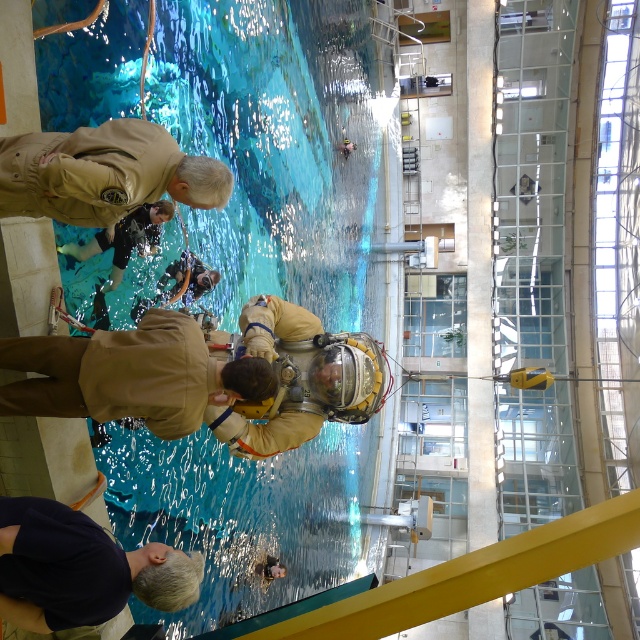
Can you confirm if blue clear water at center is taller than blue-green diving suit at center?

Correct, blue clear water at center is much taller as blue-green diving suit at center.

Measure the distance between point (372, 451) and camera.

Point (372, 451) is 56.99 meters away from camera.

This screenshot has height=640, width=640. What do you see at coordinates (280, 147) in the screenshot?
I see `blue clear water at center` at bounding box center [280, 147].

Where is `blue clear water at center`? This screenshot has height=640, width=640. blue clear water at center is located at coordinates (280, 147).

Can you confirm if blue-green diving suit at center is wider than light brown leather jacket at lower center?

Correct, the width of blue-green diving suit at center exceeds that of light brown leather jacket at lower center.

Between point (144, 220) and point (266, 556), which one is positioned in front?

Point (144, 220)

Find the location of a particular element. The width and height of the screenshot is (640, 640). blue-green diving suit at center is located at coordinates (124, 237).

Image resolution: width=640 pixels, height=640 pixels. Find the location of `blue-green diving suit at center`. blue-green diving suit at center is located at coordinates (124, 237).

Who is positioned more to the right, dark blue shirt at lower left or blue-green diving suit at center?

Positioned to the right is dark blue shirt at lower left.

Does dark blue shirt at lower left appear on the right side of blue-green diving suit at center?

Indeed, dark blue shirt at lower left is positioned on the right side of blue-green diving suit at center.

Find the location of a particular element. This screenshot has width=640, height=640. dark blue shirt at lower left is located at coordinates (81, 568).